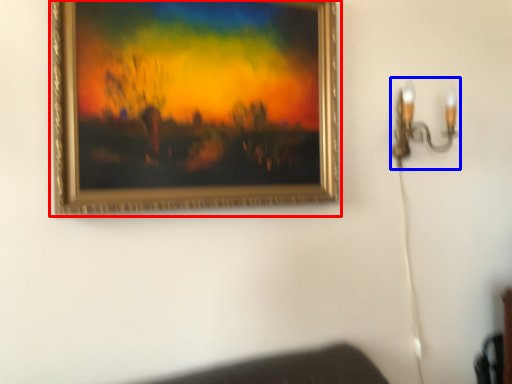
Question: Which object appears closest to the camera in this image, picture frame (highlighted by a red box) or lamp (highlighted by a blue box)?

Choices:
 (A) picture frame
 (B) lamp

Answer: (A)